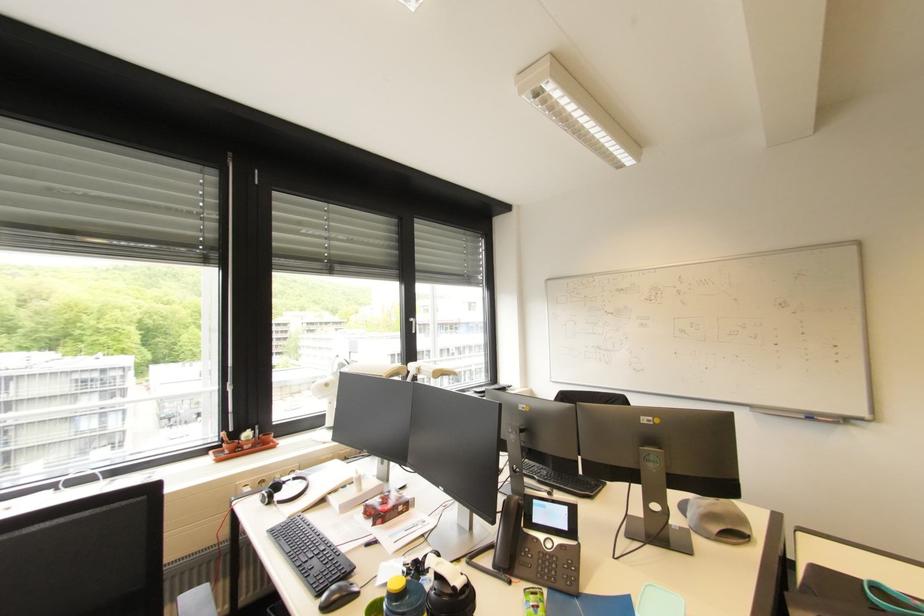
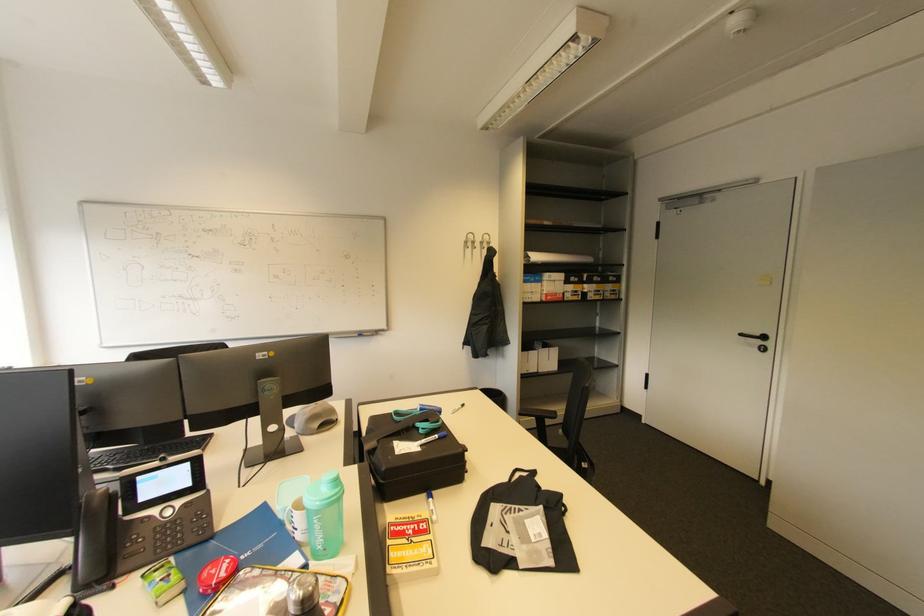
Locate, in the second image, the point that corresponds to pixel 720 530 in the first image.

(321, 426)